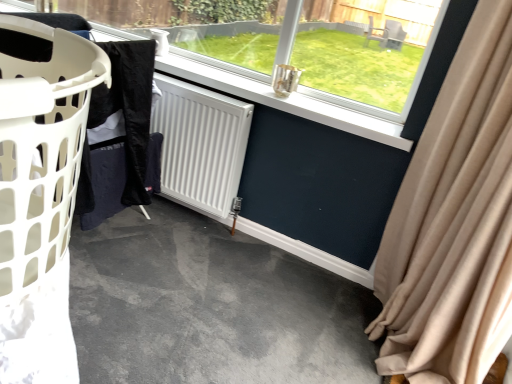
Question: Is beige fabric curtain at right positioned with its back to black fabric at left?

Choices:
 (A) yes
 (B) no

Answer: (B)

Question: Is beige fabric curtain at right taller than black fabric at left?

Choices:
 (A) yes
 (B) no

Answer: (A)

Question: From the image's perspective, is beige fabric curtain at right on black fabric at left?

Choices:
 (A) no
 (B) yes

Answer: (A)

Question: Can you confirm if beige fabric curtain at right is shorter than black fabric at left?

Choices:
 (A) yes
 (B) no

Answer: (B)

Question: Can we say beige fabric curtain at right lies outside black fabric at left?

Choices:
 (A) no
 (B) yes

Answer: (B)

Question: Would you say beige fabric curtain at right is inside or outside white plastic laundry basket at left?

Choices:
 (A) outside
 (B) inside

Answer: (A)

Question: Considering the positions of point coord(452,150) and point coord(23,248), is point coord(452,150) closer or farther from the camera than point coord(23,248)?

Choices:
 (A) closer
 (B) farther

Answer: (B)

Question: From a real-world perspective, is beige fabric curtain at right above or below white plastic laundry basket at left?

Choices:
 (A) above
 (B) below

Answer: (B)

Question: Considering the positions of beige fabric curtain at right and white plastic laundry basket at left in the image, is beige fabric curtain at right wider or thinner than white plastic laundry basket at left?

Choices:
 (A) wide
 (B) thin

Answer: (A)

Question: Is white plastic laundry basket at left taller or shorter than transparent glass window at center?

Choices:
 (A) tall
 (B) short

Answer: (A)

Question: From a real-world perspective, relative to transparent glass window at center, is white plastic laundry basket at left vertically above or below?

Choices:
 (A) above
 (B) below

Answer: (A)

Question: Based on their sizes in the image, would you say white plastic laundry basket at left is bigger or smaller than transparent glass window at center?

Choices:
 (A) small
 (B) big

Answer: (B)

Question: Based on their positions, is white plastic laundry basket at left located to the left or right of transparent glass window at center?

Choices:
 (A) right
 (B) left

Answer: (A)

Question: From a real-world perspective, is black fabric at left physically located above or below white matte radiator at center?

Choices:
 (A) below
 (B) above

Answer: (B)

Question: Is point (109, 215) closer or farther from the camera than point (208, 162)?

Choices:
 (A) farther
 (B) closer

Answer: (B)